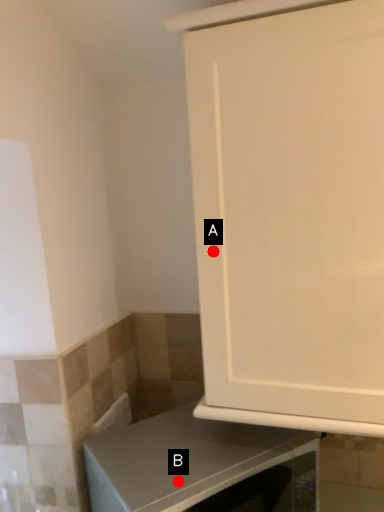
Question: Two points are circled on the image, labeled by A and B beside each circle. Which point is further to the camera?

Choices:
 (A) A is further
 (B) B is further

Answer: (A)